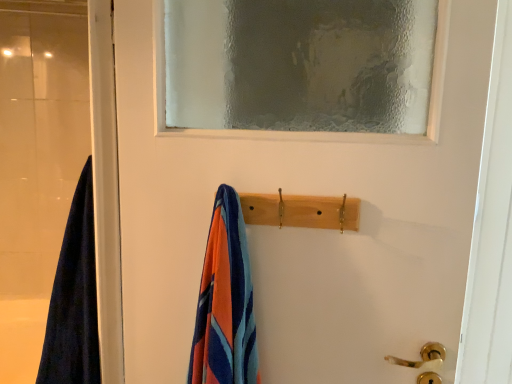
The width and height of the screenshot is (512, 384). What do you see at coordinates (37, 162) in the screenshot? I see `dark blue fabric at left` at bounding box center [37, 162].

The width and height of the screenshot is (512, 384). What are the coordinates of `dark blue fabric at left` in the screenshot? It's located at (37, 162).

Find the location of a particular element. dark blue fabric at left is located at coordinates (37, 162).